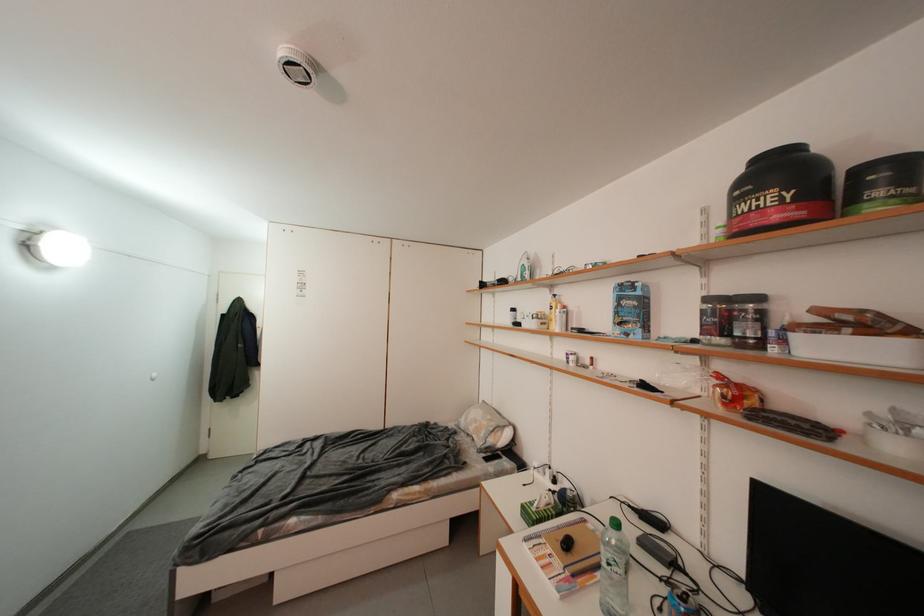
The width and height of the screenshot is (924, 616). What are the coordinates of `supplement jar lid` in the screenshot? It's located at (891, 164).